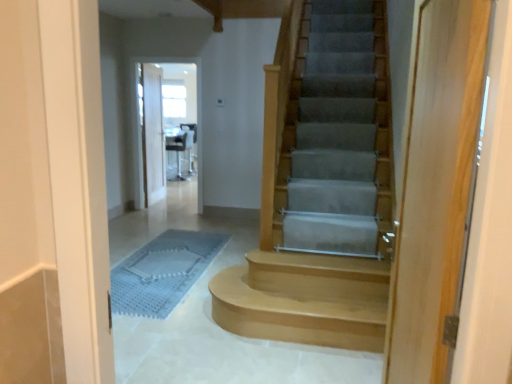
Describe the element at coordinates (304, 299) in the screenshot. I see `light brown wood stairs at center` at that location.

The height and width of the screenshot is (384, 512). Describe the element at coordinates (436, 185) in the screenshot. I see `light wood door at right, placed as the first door when sorted from right to left` at that location.

This screenshot has width=512, height=384. Describe the element at coordinates (212, 318) in the screenshot. I see `smooth concrete stairs at center` at that location.

What is the approximate width of smooth concrete stairs at center?

It is 3.55 meters.

In order to face clear glass screen door at center, should I rotate leftwards or rightwards?

To face it directly, rotate left by 11.914 degrees.

Describe the element at coordinates (162, 272) in the screenshot. Image resolution: width=512 pixels, height=384 pixels. I see `blue textured bath mat at lower center` at that location.

At what (x,y) coordinates should I click in order to perform the action: click on light brown wood stairs at center. Please return your answer as a coordinate pair (x, y). This screenshot has width=512, height=384. Looking at the image, I should click on (304, 299).

Does light brown wood stairs at center have a lesser height compared to white glossy chair at upper center?

Yes, light brown wood stairs at center is shorter than white glossy chair at upper center.

Is the surface of light brown wood stairs at center in direct contact with white glossy chair at upper center?

light brown wood stairs at center is not next to white glossy chair at upper center, and they're not touching.

Can you confirm if light brown wood stairs at center is wider than white glossy chair at upper center?

Correct, the width of light brown wood stairs at center exceeds that of white glossy chair at upper center.

From a real-world perspective, is light brown wood stairs at center located beneath white glossy chair at upper center?

Yes.

Considering the sizes of blue textured bath mat at lower center and light brown wood stairs at center in the image, is blue textured bath mat at lower center wider or thinner than light brown wood stairs at center?

Considering their sizes, blue textured bath mat at lower center looks broader than light brown wood stairs at center.

Is the surface of blue textured bath mat at lower center in direct contact with light brown wood stairs at center?

Result: There is a gap between blue textured bath mat at lower center and light brown wood stairs at center.

Looking at this image, based on their positions, is blue textured bath mat at lower center located to the left or right of light brown wood stairs at center?

Based on their positions, blue textured bath mat at lower center is located to the left of light brown wood stairs at center.

Can we say light brown wood stairs at center lies outside white wood door at upper center, the 1th door positioned from the back?

light brown wood stairs at center is positioned outside white wood door at upper center, the 1th door positioned from the back.

You are a GUI agent. You are given a task and a screenshot of the screen. Output one action in this format:
    pyautogui.click(x=<x>, y=<y>)
    Task: Click on the door behind the light brown wood stairs at center
    The height and width of the screenshot is (384, 512).
    Given the screenshot: What is the action you would take?
    pyautogui.click(x=152, y=134)

Is light brown wood stairs at center closer to camera compared to white wood door at upper center, the 2th door in the right-to-left sequence?

Yes.

How distant is light wood door at right, placed as the first door when sorted from right to left, from white glossy chair at upper center?

light wood door at right, placed as the first door when sorted from right to left, is 23.09 feet away from white glossy chair at upper center.

Can you confirm if light wood door at right, placed as the first door when sorted from right to left, is shorter than white glossy chair at upper center?

No, light wood door at right, placed as the first door when sorted from right to left, is not shorter than white glossy chair at upper center.

Which of these two, light wood door at right, the 2th door when ordered from left to right, or white glossy chair at upper center, is bigger?

Bigger between the two is white glossy chair at upper center.

Locate an element on the screen. The width and height of the screenshot is (512, 384). door lying on the right of white glossy chair at upper center is located at coordinates (436, 185).

Which of these two, clear glass screen door at center or light brown wood stairs at center, stands taller?

Standing taller between the two is clear glass screen door at center.

Is point (196, 62) farther from viewer compared to point (348, 339)?

Yes, point (196, 62) is farther from viewer.

Do you think clear glass screen door at center is within light brown wood stairs at center, or outside of it?

clear glass screen door at center is not inside light brown wood stairs at center, it's outside.

Considering the relative positions of blue textured bath mat at lower center and clear glass screen door at center in the image provided, is blue textured bath mat at lower center to the right of clear glass screen door at center from the viewer's perspective?

Correct, you'll find blue textured bath mat at lower center to the right of clear glass screen door at center.

From the image's perspective, is blue textured bath mat at lower center above or below clear glass screen door at center?

Based on their image positions, blue textured bath mat at lower center is located beneath clear glass screen door at center.

Is blue textured bath mat at lower center directly adjacent to clear glass screen door at center?

No, blue textured bath mat at lower center is not next to clear glass screen door at center.

Which is behind, point (144, 260) or point (159, 59)?

The point (159, 59) is more distant.

Is white glossy chair at upper center shorter than white wood door at upper center, which is the second door in front-to-back order?

Yes.

Can you tell me how much white glossy chair at upper center and white wood door at upper center, which is the second door in front-to-back order, differ in facing direction?

The angular difference between white glossy chair at upper center and white wood door at upper center, which is the second door in front-to-back order, is 170 degrees.

From a real-world perspective, is white glossy chair at upper center located beneath white wood door at upper center, the first door positioned from the left?

Yes, from a real-world perspective, white glossy chair at upper center is under white wood door at upper center, the first door positioned from the left.

Is white glossy chair at upper center beside white wood door at upper center, the 2th door in the right-to-left sequence?

No, white glossy chair at upper center is not beside white wood door at upper center, the 2th door in the right-to-left sequence.

You are a GUI agent. You are given a task and a screenshot of the screen. Output one action in this format:
    pyautogui.click(x=<x>, y=<y>)
    Task: Click on the landing located above the light brown wood stairs at center (from the image's perspective)
    
    Given the screenshot: What is the action you would take?
    pyautogui.click(x=182, y=150)

Locate an element on the screen. The image size is (512, 384). bath mat on the left of light brown wood stairs at center is located at coordinates (162, 272).

In the scene shown: Looking at the image, which one is located closer to smooth concrete stairs at center, blue textured bath mat at lower center or white wood door at upper center, which is the second door in front-to-back order?

The object closer to smooth concrete stairs at center is blue textured bath mat at lower center.

Looking at this image, looking at the image, which one is located closer to white glossy chair at upper center, smooth concrete stairs at center or light wood door at right, the 2th door when ordered from left to right?

smooth concrete stairs at center is positioned closer to the anchor white glossy chair at upper center.

When comparing their distances from white glossy chair at upper center, does blue textured bath mat at lower center or light wood door at right, placed as the first door when sorted from right to left, seem closer?

The object closer to white glossy chair at upper center is blue textured bath mat at lower center.

When comparing their distances from light brown wood stairs at center, does white glossy chair at upper center or blue textured bath mat at lower center seem closer?

The object closer to light brown wood stairs at center is blue textured bath mat at lower center.

Estimate the real-world distances between objects in this image. Which object is closer to white wood door at upper center, the first door positioned from the left, blue textured bath mat at lower center or white glossy chair at upper center?

white glossy chair at upper center.

Estimate the real-world distances between objects in this image. Which object is further from white wood door at upper center, the 1th door positioned from the back, white glossy chair at upper center or clear glass screen door at center?

white glossy chair at upper center is further to white wood door at upper center, the 1th door positioned from the back.

Which object lies nearer to the anchor point light brown wood stairs at center, white wood door at upper center, the first door positioned from the left, or clear glass screen door at center?

clear glass screen door at center.

Looking at this image, considering their positions, is clear glass screen door at center positioned further to white glossy chair at upper center than light brown wood stairs at center?

The object further to white glossy chair at upper center is light brown wood stairs at center.

Find the location of `stairs between smooth concrete stairs at center and white wood door at upper center, which is the second door in front-to-back order, from front to back`. stairs between smooth concrete stairs at center and white wood door at upper center, which is the second door in front-to-back order, from front to back is located at coordinates (304, 299).

In order to click on screen door positioned between light brown wood stairs at center and white glossy chair at upper center from near to far in this screenshot , I will do `click(196, 110)`.

Find the location of a particular element. door positioned between light brown wood stairs at center and white glossy chair at upper center from near to far is located at coordinates (152, 134).

Locate an element on the screen. This screenshot has height=384, width=512. stairs between smooth concrete stairs at center and clear glass screen door at center from front to back is located at coordinates (304, 299).